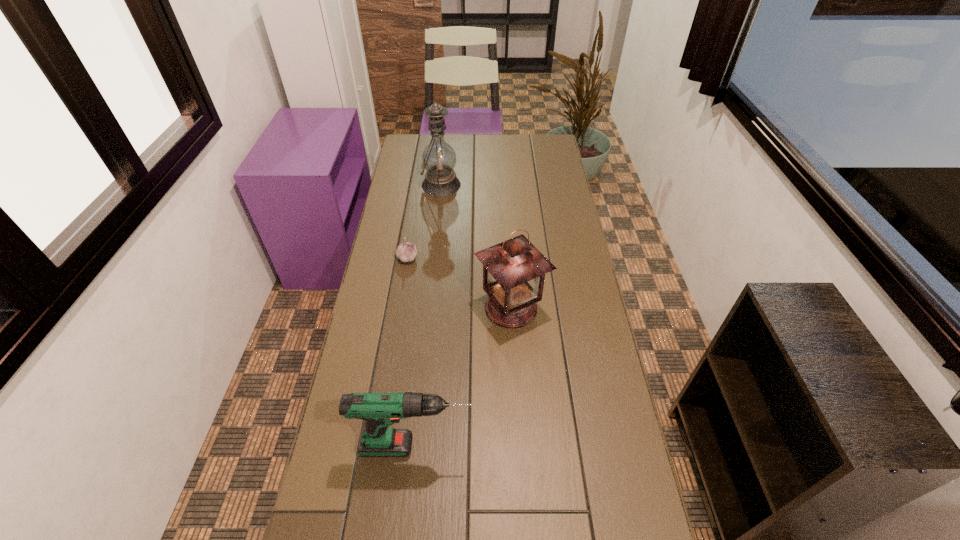
Find the location of a particular element. the left oil lamp is located at coordinates (439, 158).

At what (x,y) coordinates should I click in order to perform the action: click on the farther oil lamp. Please return your answer as a coordinate pair (x, y). The image size is (960, 540). Looking at the image, I should click on (439, 158).

Find the location of `the nearer oil lamp`. the nearer oil lamp is located at coordinates (514, 271).

Locate an element on the screen. Image resolution: width=960 pixels, height=540 pixels. the third farthest object is located at coordinates (514, 271).

Locate an element on the screen. The height and width of the screenshot is (540, 960). the nearest object is located at coordinates (379, 410).

Where is `the second shortest object`? The image size is (960, 540). the second shortest object is located at coordinates (379, 410).

You are a GUI agent. You are given a task and a screenshot of the screen. Output one action in this format:
    pyautogui.click(x=<x>, y=<y>)
    Task: Click on the garlic
    
    Given the screenshot: What is the action you would take?
    pyautogui.click(x=406, y=252)

This screenshot has height=540, width=960. Identify the location of the third nearest object. (406, 252).

Locate an element on the screen. vacant space situated 0.370m on the right of the farther oil lamp is located at coordinates (547, 185).

The height and width of the screenshot is (540, 960). What are the coordinates of `free space located on the left of the nearer oil lamp` in the screenshot? It's located at (415, 308).